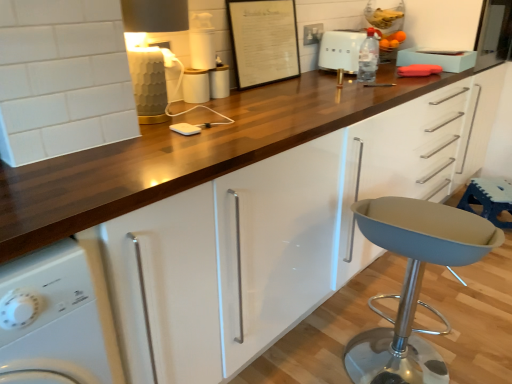
Question: Is white glossy cup at center, which is the 2th appliance in bottom-to-top order, behind blue fabric bar stool at lower right?

Choices:
 (A) no
 (B) yes

Answer: (A)

Question: Does white glossy cup at center, the 3th appliance when ordered from top to bottom, have a lesser width compared to blue fabric bar stool at lower right?

Choices:
 (A) yes
 (B) no

Answer: (A)

Question: Could you tell me if white glossy cup at center, which is the 2th appliance in bottom-to-top order, is turned towards blue fabric bar stool at lower right?

Choices:
 (A) yes
 (B) no

Answer: (B)

Question: Considering the relative positions of white glossy cup at center, which is the 2th appliance in bottom-to-top order, and blue fabric bar stool at lower right in the image provided, is white glossy cup at center, which is the 2th appliance in bottom-to-top order, to the right of blue fabric bar stool at lower right from the viewer's perspective?

Choices:
 (A) yes
 (B) no

Answer: (B)

Question: Considering the relative sizes of white glossy cup at center, which is the 2th appliance in bottom-to-top order, and blue fabric bar stool at lower right in the image provided, is white glossy cup at center, which is the 2th appliance in bottom-to-top order, smaller than blue fabric bar stool at lower right?

Choices:
 (A) yes
 (B) no

Answer: (A)

Question: Which is correct: white plastic electric outlet at upper center is inside white plastic container at upper center, which appears as the fourth appliance when ordered from the bottom, or outside of it?

Choices:
 (A) outside
 (B) inside

Answer: (A)

Question: Is point (314, 24) positioned closer to the camera than point (197, 67)?

Choices:
 (A) farther
 (B) closer

Answer: (A)

Question: In the image, is white plastic electric outlet at upper center positioned in front of or behind white plastic container at upper center, which appears as the fourth appliance when ordered from the bottom?

Choices:
 (A) behind
 (B) front

Answer: (A)

Question: From a real-world perspective, is white plastic electric outlet at upper center above or below white plastic container at upper center, which appears as the fourth appliance when ordered from the bottom?

Choices:
 (A) below
 (B) above

Answer: (A)

Question: Relative to white plastic container at upper center, the 1th appliance in the top-to-bottom sequence, is white paper at upper center in front or behind?

Choices:
 (A) behind
 (B) front

Answer: (A)

Question: Considering the relative positions of white paper at upper center and white plastic container at upper center, which appears as the fourth appliance when ordered from the bottom, in the image provided, is white paper at upper center to the left or to the right of white plastic container at upper center, which appears as the fourth appliance when ordered from the bottom,?

Choices:
 (A) right
 (B) left

Answer: (A)

Question: Is white paper at upper center taller or shorter than white plastic container at upper center, the 1th appliance in the top-to-bottom sequence?

Choices:
 (A) short
 (B) tall

Answer: (B)

Question: Is white paper at upper center situated inside white plastic container at upper center, which appears as the fourth appliance when ordered from the bottom, or outside?

Choices:
 (A) inside
 (B) outside

Answer: (B)

Question: In the image, is blue fabric bar stool at lower right positioned in front of or behind white glossy washing machine at lower left?

Choices:
 (A) behind
 (B) front

Answer: (A)

Question: Based on their sizes in the image, would you say blue fabric bar stool at lower right is bigger or smaller than white glossy washing machine at lower left?

Choices:
 (A) small
 (B) big

Answer: (A)